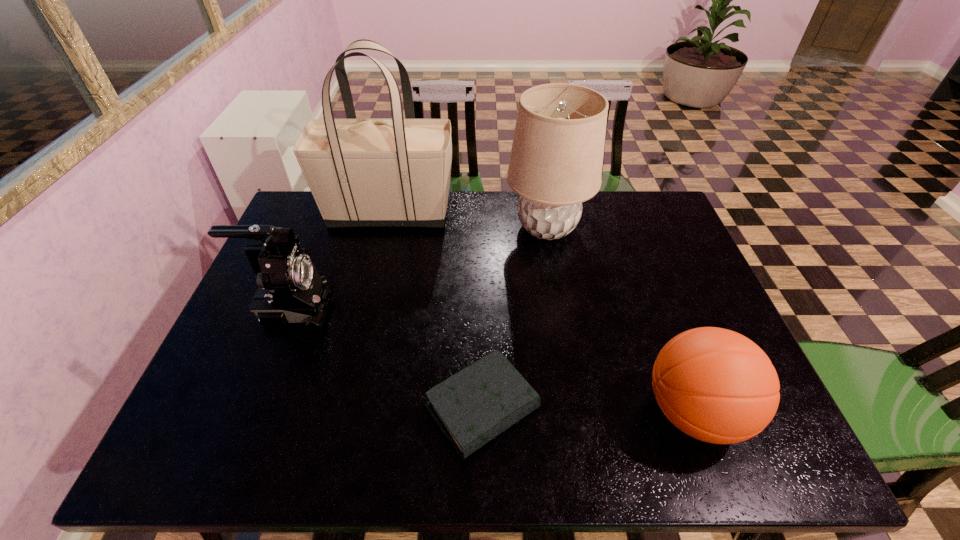
This screenshot has width=960, height=540. What are the coordinates of `shopping bag` in the screenshot? It's located at (395, 172).

At what (x,y) coordinates should I click in order to perform the action: click on lampshade. Please return your answer as a coordinate pair (x, y). Image resolution: width=960 pixels, height=540 pixels. Looking at the image, I should click on (556, 160).

Locate an element on the screen. Image resolution: width=960 pixels, height=540 pixels. the third farthest object is located at coordinates (290, 290).

Identify the location of the rightmost object. (715, 385).

I want to click on basketball, so click(x=715, y=385).

What are the coordinates of `the shortest object` in the screenshot? It's located at (473, 406).

Find the location of a particular element. This screenshot has height=540, width=960. vacant area located 0.340m with handles facing forward on the shopping bag is located at coordinates (556, 212).

This screenshot has width=960, height=540. In order to click on free location located on the right of the second tallest object in this screenshot , I will do point(614,227).

I want to click on vacant space situated on the lens mount of the camcorder, so click(478, 307).

Locate an element on the screen. This screenshot has width=960, height=540. vacant point located on the back of the basketball is located at coordinates (656, 310).